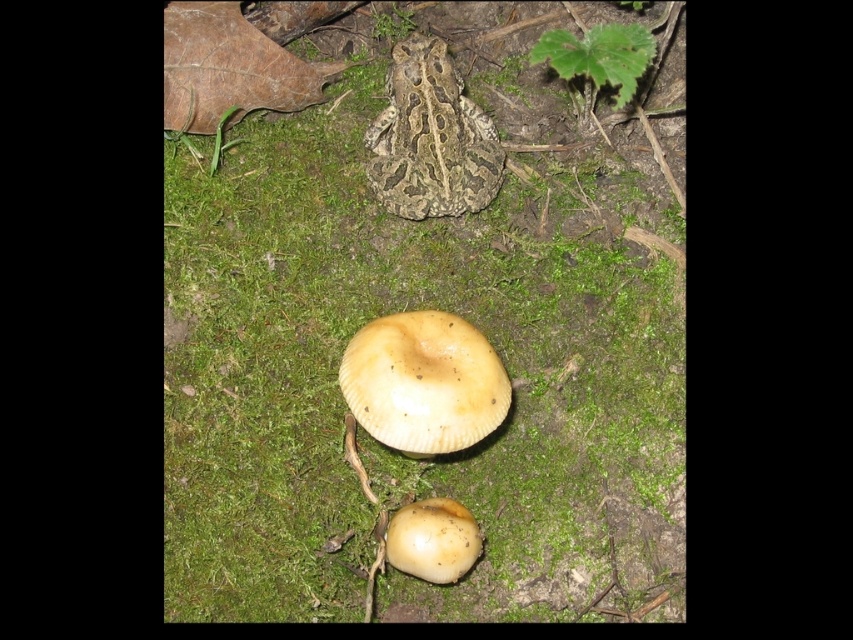
Is light brown matte mushroom at center bigger than camouflage-patterned frog at center?

Indeed, light brown matte mushroom at center has a larger size compared to camouflage-patterned frog at center.

This screenshot has height=640, width=853. Find the location of `light brown matte mushroom at center`. light brown matte mushroom at center is located at coordinates (422, 381).

Where is `light brown matte mushroom at center`? light brown matte mushroom at center is located at coordinates (422, 381).

Consider the image. Can you confirm if light brown matte mushroom at center is shorter than smooth beige mushroom at center?

No, light brown matte mushroom at center is not shorter than smooth beige mushroom at center.

Does light brown matte mushroom at center come behind smooth beige mushroom at center?

Yes, it is behind smooth beige mushroom at center.

The width and height of the screenshot is (853, 640). What do you see at coordinates (422, 381) in the screenshot? I see `light brown matte mushroom at center` at bounding box center [422, 381].

The image size is (853, 640). I want to click on light brown matte mushroom at center, so click(x=422, y=381).

Describe the element at coordinates (431, 138) in the screenshot. This screenshot has width=853, height=640. I see `camouflage-patterned frog at center` at that location.

Does camouflage-patterned frog at center appear under smooth beige mushroom at center?

Actually, camouflage-patterned frog at center is above smooth beige mushroom at center.

Locate an element on the screen. The height and width of the screenshot is (640, 853). camouflage-patterned frog at center is located at coordinates click(431, 138).